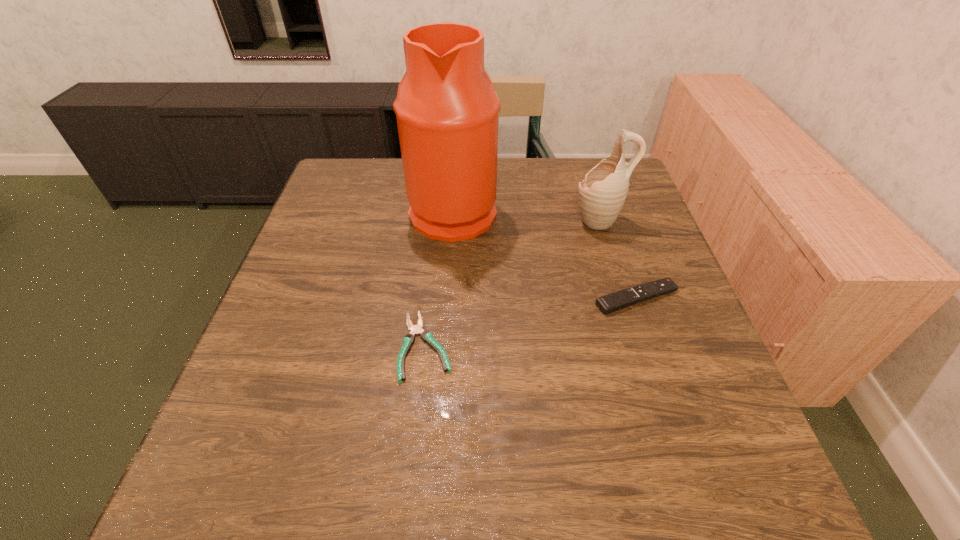
Where is `the tallest object`? the tallest object is located at coordinates (447, 110).

This screenshot has height=540, width=960. I want to click on the third shortest object, so click(602, 193).

Where is `remote control`? The image size is (960, 540). remote control is located at coordinates [624, 298].

The image size is (960, 540). Find the location of `the shortest object`. the shortest object is located at coordinates (427, 336).

You are a GUI agent. You are given a task and a screenshot of the screen. Output one action in this format:
    pyautogui.click(x=<x>, y=<y>)
    Task: Click on the vacant area situated 0.240m from the spout of the water jug
    
    Given the screenshot: What is the action you would take?
    pyautogui.click(x=587, y=210)

Find the location of `vacant space situated 0.190m at the spout of the third shortest object`. vacant space situated 0.190m at the spout of the third shortest object is located at coordinates (500, 221).

The image size is (960, 540). I want to click on vacant space located 0.180m at the spout of the third shortest object, so tap(504, 221).

You are a GUI agent. You are given a task and a screenshot of the screen. Output one action in this format:
    pyautogui.click(x=<x>, y=<y>)
    Task: Click on the free space located at the spout of the third shortest object
    Image resolution: width=960 pixels, height=540 pixels.
    Given the screenshot: What is the action you would take?
    pyautogui.click(x=469, y=221)

The height and width of the screenshot is (540, 960). Find the location of `free space located on the front of the remote control`. free space located on the front of the remote control is located at coordinates (684, 434).

Identify the location of free spot located on the right of the pliers. This screenshot has height=540, width=960. (519, 346).